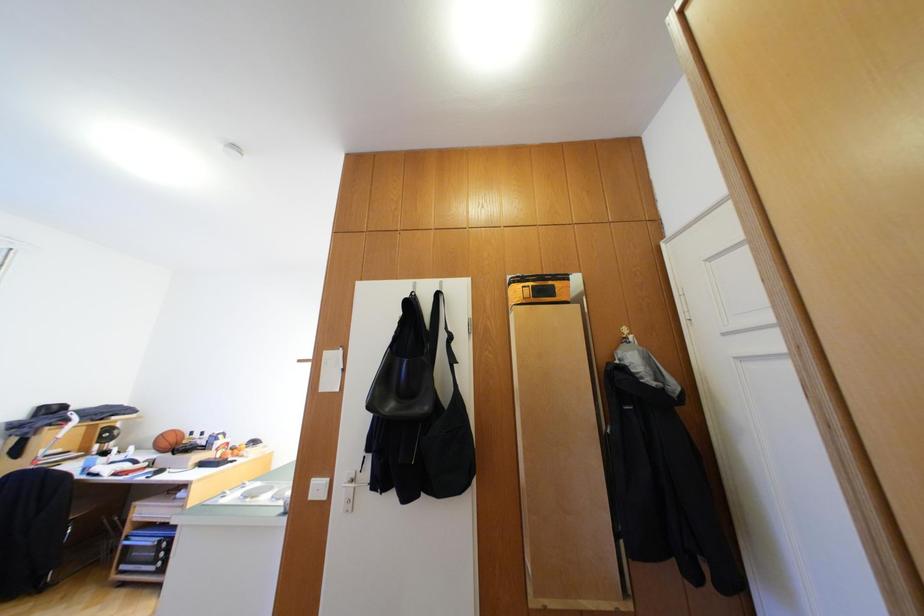
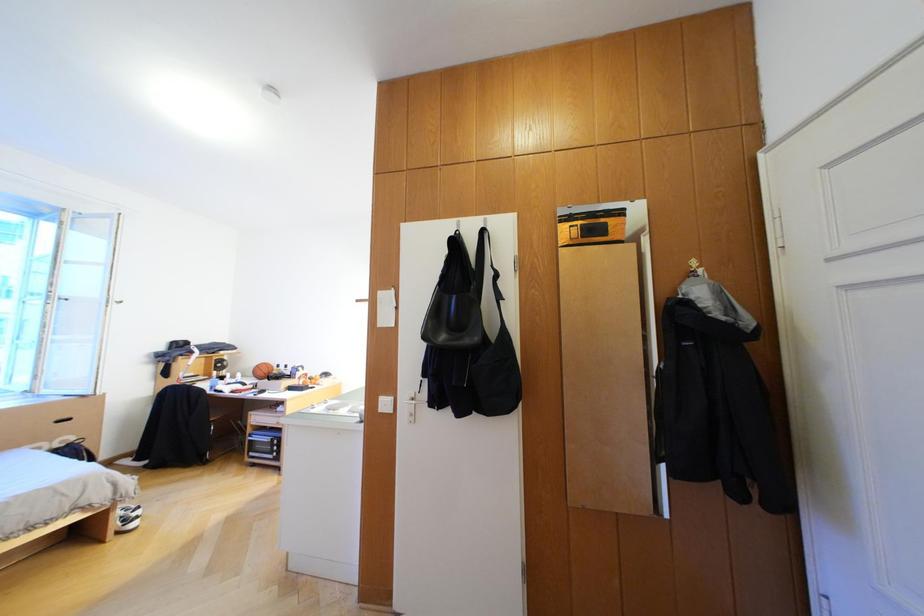
In a continuous first-person perspective shot, in which direction is the camera moving?

The movement direction of the cameraman is left, backward.